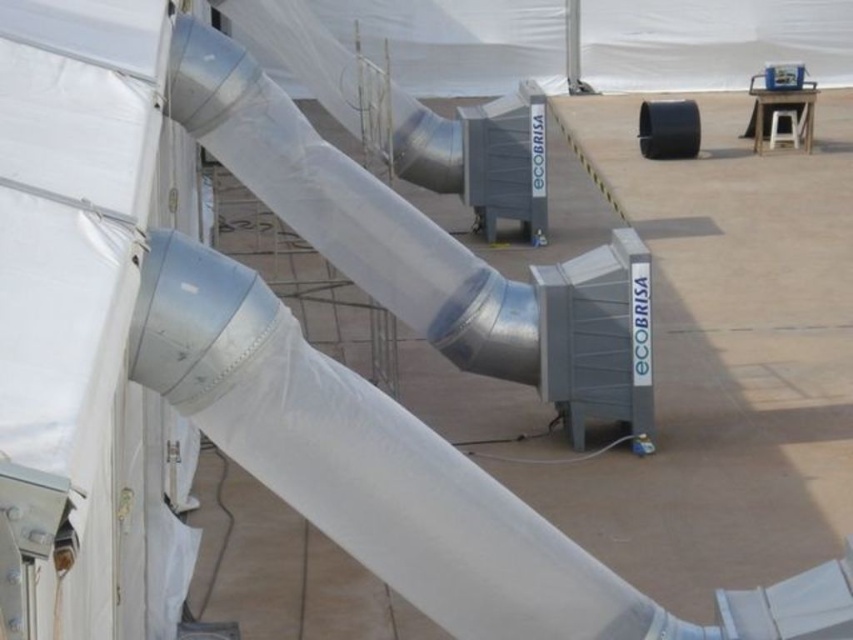
You are an engineer inspecting the duct system. You need to locate the silver metallic pole at upper center. Where exactly is it positioned in the image?

The silver metallic pole at upper center is positioned at point coordinates of (x=572, y=45).

You are a maintenance worker needing to reach the silver metallic pole at upper center. You have a ladder that is 15 feet long. You see the white plastic stool at upper right. Can you use the stool to safely reach the pole?

The silver metallic pole at upper center is 20.49 feet away from the white plastic stool at upper right. Since the ladder is only 15 feet long, it is not long enough to bridge the distance between them. Therefore, you cannot safely reach the pole using the stool and ladder.

You are a maintenance worker needing to reach the silver metallic pole at upper center for inspection. You have the white plastic stool at upper right available. Can the stool help you reach the pole?

The silver metallic pole at upper center is taller than the white plastic stool at upper right, so the stool may not provide enough height to reach the pole.